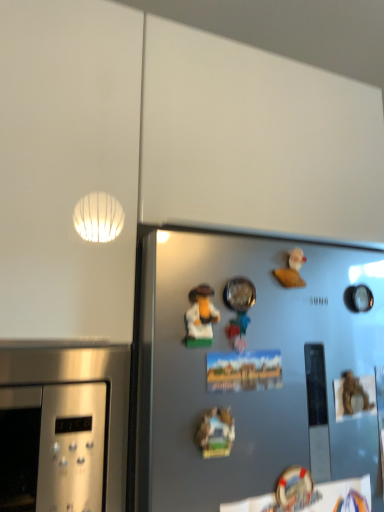
In order to click on wooden miniature house at center, which is the 2th art from top to bottom in this screenshot , I will do `click(216, 433)`.

How much space does white matte rubber duck at upper right, positioned as the first toy in right-to-left order, occupy vertically?

The height of white matte rubber duck at upper right, positioned as the first toy in right-to-left order, is 2.99 inches.

The height and width of the screenshot is (512, 384). In order to click on metallic silver bowl at center, the first toy when ordered from left to right in this screenshot , I will do `click(239, 309)`.

Where is `wooden miniature house at center, the 1th art ordered from the bottom`? The image size is (384, 512). wooden miniature house at center, the 1th art ordered from the bottom is located at coordinates (216, 433).

Considering the positions of objects wooden miniature house at center, which is the 2th art from top to bottom, and metallic silver bowl at center, the 2th toy when ordered from back to front, in the image provided, who is behind, wooden miniature house at center, which is the 2th art from top to bottom, or metallic silver bowl at center, the 2th toy when ordered from back to front,?

metallic silver bowl at center, the 2th toy when ordered from back to front, is behind.

Considering the positions of objects wooden miniature house at center, the 1th art ordered from the bottom, and metallic silver bowl at center, the first toy when ordered from left to right, in the image provided, who is more to the left, wooden miniature house at center, the 1th art ordered from the bottom, or metallic silver bowl at center, the first toy when ordered from left to right,?

wooden miniature house at center, the 1th art ordered from the bottom, is more to the left.

From a real-world perspective, between metallic silver bowl at center, the 2th toy when ordered from back to front, and matte plastic toy at center, marked as the first art in a top-to-bottom arrangement, who is vertically lower?

In real-world perspective, matte plastic toy at center, marked as the first art in a top-to-bottom arrangement, is lower.

Between point (236, 328) and point (186, 343), which one is positioned behind?

The point (236, 328) is farther from the camera.

Between metallic silver bowl at center, the first toy when ordered from left to right, and matte plastic toy at center, marked as the first art in a top-to-bottom arrangement, which one has larger size?

metallic silver bowl at center, the first toy when ordered from left to right, is bigger.

Which object is positioned more to the left, matte plastic toy at center, marked as the first art in a top-to-bottom arrangement, or wooden miniature house at center, the 1th art ordered from the bottom?

Positioned to the left is matte plastic toy at center, marked as the first art in a top-to-bottom arrangement.

Can you see matte plastic toy at center, which appears as the second art when ordered from the bottom, touching wooden miniature house at center, the 1th art ordered from the bottom?

No, matte plastic toy at center, which appears as the second art when ordered from the bottom, is not next to wooden miniature house at center, the 1th art ordered from the bottom.

Based on their sizes in the image, would you say matte plastic toy at center, marked as the first art in a top-to-bottom arrangement, is bigger or smaller than wooden miniature house at center, the 1th art ordered from the bottom?

Considering their sizes, matte plastic toy at center, marked as the first art in a top-to-bottom arrangement, takes up more space than wooden miniature house at center, the 1th art ordered from the bottom.

From a real-world perspective, is white matte rubber duck at upper right, the first toy viewed from the back, physically located above or below metallic silver bowl at center, the 2th toy when ordered from back to front?

white matte rubber duck at upper right, the first toy viewed from the back, is situated higher than metallic silver bowl at center, the 2th toy when ordered from back to front, in the real world.

Which of these two, white matte rubber duck at upper right, placed as the 2th toy when sorted from front to back, or metallic silver bowl at center, the first toy positioned from the front, is thinner?

With smaller width is white matte rubber duck at upper right, placed as the 2th toy when sorted from front to back.

Which is correct: white matte rubber duck at upper right, placed as the 2th toy when sorted from front to back, is inside metallic silver bowl at center, the first toy positioned from the front, or outside of it?

white matte rubber duck at upper right, placed as the 2th toy when sorted from front to back, is not inside metallic silver bowl at center, the first toy positioned from the front, it's outside.

Is metallic silver bowl at center, the 2th toy when ordered from back to front, placed right next to wooden miniature house at center, which is the 2th art from top to bottom?

They are not placed beside each other.

Looking at this image, from a real-world perspective, which is physically below, metallic silver bowl at center, the second toy in the right-to-left sequence, or wooden miniature house at center, which is the 2th art from top to bottom?

wooden miniature house at center, which is the 2th art from top to bottom, is physically lower.

From the image's perspective, which one is positioned higher, metallic silver bowl at center, the second toy in the right-to-left sequence, or wooden miniature house at center, which is the 2th art from top to bottom?

metallic silver bowl at center, the second toy in the right-to-left sequence, from the image's perspective.

Is metallic silver bowl at center, the first toy when ordered from left to right, to the right of wooden miniature house at center, the 1th art ordered from the bottom, from the viewer's perspective?

Yes, metallic silver bowl at center, the first toy when ordered from left to right, is to the right of wooden miniature house at center, the 1th art ordered from the bottom.

Is metallic silver bowl at center, the 2th toy when ordered from back to front, placed right next to white matte rubber duck at upper right, placed as the 2th toy when sorted from front to back?

Absolutely, metallic silver bowl at center, the 2th toy when ordered from back to front, is next to and touching white matte rubber duck at upper right, placed as the 2th toy when sorted from front to back.

Does metallic silver bowl at center, the first toy positioned from the front, appear on the left side of white matte rubber duck at upper right, placed as the 2th toy when sorted from front to back?

Yes, metallic silver bowl at center, the first toy positioned from the front, is to the left of white matte rubber duck at upper right, placed as the 2th toy when sorted from front to back.

Does metallic silver bowl at center, the first toy when ordered from left to right, have a smaller size compared to white matte rubber duck at upper right, the first toy viewed from the back?

Incorrect, metallic silver bowl at center, the first toy when ordered from left to right, is not smaller in size than white matte rubber duck at upper right, the first toy viewed from the back.

Which object is closer to the camera taking this photo, metallic silver bowl at center, the first toy when ordered from left to right, or white matte rubber duck at upper right, which appears as the 2th toy when viewed from the left?

metallic silver bowl at center, the first toy when ordered from left to right, is closer to the camera.

From the image's perspective, is white matte rubber duck at upper right, positioned as the first toy in right-to-left order, above matte plastic toy at center, which appears as the second art when ordered from the bottom?

Yes, from the image's perspective, white matte rubber duck at upper right, positioned as the first toy in right-to-left order, is over matte plastic toy at center, which appears as the second art when ordered from the bottom.

Which object is positioned more to the left, white matte rubber duck at upper right, the first toy viewed from the back, or matte plastic toy at center, marked as the first art in a top-to-bottom arrangement?

Positioned to the left is matte plastic toy at center, marked as the first art in a top-to-bottom arrangement.

Can you tell me how much white matte rubber duck at upper right, positioned as the first toy in right-to-left order, and matte plastic toy at center, marked as the first art in a top-to-bottom arrangement, differ in facing direction?

They differ by 3.5 degrees in their facing directions.

Is white matte rubber duck at upper right, placed as the 2th toy when sorted from front to back, positioned with its back to matte plastic toy at center, marked as the first art in a top-to-bottom arrangement?

No, white matte rubber duck at upper right, placed as the 2th toy when sorted from front to back,'s orientation is not away from matte plastic toy at center, marked as the first art in a top-to-bottom arrangement.

Which toy is the 1st one when counting from the back of the wooden miniature house at center, the 1th art ordered from the bottom? Please provide its 2D coordinates.

[(239, 309)]

You are a GUI agent. You are given a task and a screenshot of the screen. Output one action in this format:
    pyautogui.click(x=<x>, y=<y>)
    Task: Click on the art that is the 1st object located in front of the metallic silver bowl at center, the 2th toy when ordered from back to front
    This screenshot has width=384, height=512.
    Given the screenshot: What is the action you would take?
    pyautogui.click(x=200, y=317)

When comparing their distances from wooden miniature house at center, the 1th art ordered from the bottom, does matte plastic toy at center, marked as the first art in a top-to-bottom arrangement, or metallic silver bowl at center, the first toy when ordered from left to right, seem further?

metallic silver bowl at center, the first toy when ordered from left to right, is further to wooden miniature house at center, the 1th art ordered from the bottom.

Considering their positions, is wooden miniature house at center, the 1th art ordered from the bottom, positioned further to matte plastic toy at center, marked as the first art in a top-to-bottom arrangement, than white matte rubber duck at upper right, placed as the 2th toy when sorted from front to back?

white matte rubber duck at upper right, placed as the 2th toy when sorted from front to back, lies further to matte plastic toy at center, marked as the first art in a top-to-bottom arrangement, than the other object.

Which object lies nearer to the anchor point white matte rubber duck at upper right, placed as the 2th toy when sorted from front to back, matte plastic toy at center, marked as the first art in a top-to-bottom arrangement, or metallic silver bowl at center, the second toy in the right-to-left sequence?

The object closer to white matte rubber duck at upper right, placed as the 2th toy when sorted from front to back, is metallic silver bowl at center, the second toy in the right-to-left sequence.

When comparing their distances from white matte rubber duck at upper right, the first toy viewed from the back, does matte plastic toy at center, which appears as the second art when ordered from the bottom, or wooden miniature house at center, which is the 2th art from top to bottom, seem further?

wooden miniature house at center, which is the 2th art from top to bottom, is positioned further to the anchor white matte rubber duck at upper right, the first toy viewed from the back.

When comparing their distances from matte plastic toy at center, which appears as the second art when ordered from the bottom, does metallic silver bowl at center, the second toy in the right-to-left sequence, or white matte rubber duck at upper right, which appears as the 2th toy when viewed from the left, seem closer?

Among the two, metallic silver bowl at center, the second toy in the right-to-left sequence, is located nearer to matte plastic toy at center, which appears as the second art when ordered from the bottom.

When comparing their distances from wooden miniature house at center, which is the 2th art from top to bottom, does white matte rubber duck at upper right, positioned as the first toy in right-to-left order, or metallic silver bowl at center, the first toy when ordered from left to right, seem closer?

Based on the image, metallic silver bowl at center, the first toy when ordered from left to right, appears to be nearer to wooden miniature house at center, which is the 2th art from top to bottom.

Considering their positions, is white matte rubber duck at upper right, the first toy viewed from the back, positioned further to metallic silver bowl at center, the first toy positioned from the front, than matte plastic toy at center, which appears as the second art when ordered from the bottom?

Among the two, white matte rubber duck at upper right, the first toy viewed from the back, is located further to metallic silver bowl at center, the first toy positioned from the front.

Looking at the image, which one is located closer to matte plastic toy at center, which appears as the second art when ordered from the bottom, white matte rubber duck at upper right, which appears as the 2th toy when viewed from the left, or metallic silver bowl at center, the 2th toy when ordered from back to front?

metallic silver bowl at center, the 2th toy when ordered from back to front, lies closer to matte plastic toy at center, which appears as the second art when ordered from the bottom, than the other object.

Locate an element on the screen. toy between matte plastic toy at center, which appears as the second art when ordered from the bottom, and white matte rubber duck at upper right, placed as the 2th toy when sorted from front to back is located at coordinates (239, 309).

The width and height of the screenshot is (384, 512). I want to click on toy between white matte rubber duck at upper right, placed as the 2th toy when sorted from front to back, and wooden miniature house at center, the 1th art ordered from the bottom, in the up-down direction, so click(x=239, y=309).

Find the location of `toy between matte plastic toy at center, marked as the first art in a top-to-bottom arrangement, and wooden miniature house at center, the 1th art ordered from the bottom, in the vertical direction`. toy between matte plastic toy at center, marked as the first art in a top-to-bottom arrangement, and wooden miniature house at center, the 1th art ordered from the bottom, in the vertical direction is located at coordinates (239, 309).

Image resolution: width=384 pixels, height=512 pixels. In order to click on art between white matte rubber duck at upper right, positioned as the first toy in right-to-left order, and wooden miniature house at center, which is the 2th art from top to bottom, vertically in this screenshot , I will do `click(200, 317)`.